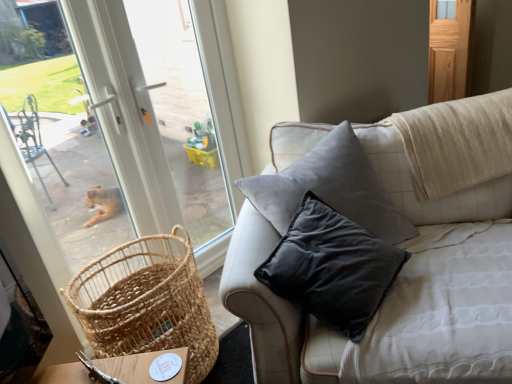
Question: Is wooden screen door at upper right at the right side of velvet grey pillow at upper right?

Choices:
 (A) yes
 (B) no

Answer: (A)

Question: Can you confirm if wooden screen door at upper right is wider than velvet grey pillow at upper right?

Choices:
 (A) yes
 (B) no

Answer: (B)

Question: Is wooden screen door at upper right completely or partially outside of velvet grey pillow at upper right?

Choices:
 (A) yes
 (B) no

Answer: (A)

Question: Is wooden screen door at upper right directly adjacent to velvet grey pillow at upper right?

Choices:
 (A) yes
 (B) no

Answer: (B)

Question: Can you confirm if wooden screen door at upper right is positioned to the left of velvet grey pillow at upper right?

Choices:
 (A) yes
 (B) no

Answer: (B)

Question: Considering the relative positions of wooden screen door at upper right and velvet grey pillow at upper right in the image provided, is wooden screen door at upper right behind velvet grey pillow at upper right?

Choices:
 (A) yes
 (B) no

Answer: (A)

Question: From a real-world perspective, is velvet grey pillow at upper right located higher than wooden screen door at upper right?

Choices:
 (A) yes
 (B) no

Answer: (B)

Question: Does velvet grey pillow at upper right come in front of wooden screen door at upper right?

Choices:
 (A) no
 (B) yes

Answer: (B)

Question: Is velvet grey pillow at upper right taller than wooden screen door at upper right?

Choices:
 (A) no
 (B) yes

Answer: (B)

Question: Does velvet grey pillow at upper right have a lesser height compared to wooden screen door at upper right?

Choices:
 (A) no
 (B) yes

Answer: (A)

Question: Is wooden screen door at upper right completely or partially inside velvet grey pillow at upper right?

Choices:
 (A) yes
 (B) no

Answer: (B)

Question: Is velvet grey pillow at upper right bigger than wooden screen door at upper right?

Choices:
 (A) yes
 (B) no

Answer: (A)

Question: From a real-world perspective, does velvet grey pillow at upper right stand above woven natural basket at lower left?

Choices:
 (A) yes
 (B) no

Answer: (A)